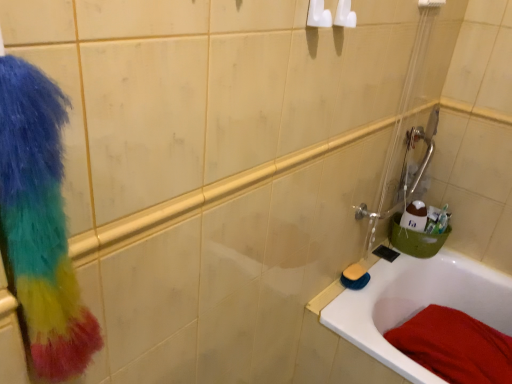
What do you see at coordinates (417, 304) in the screenshot?
I see `white glossy bathtub at lower right` at bounding box center [417, 304].

What do you see at coordinates (40, 222) in the screenshot? I see `multicolored fluffy scrub at left` at bounding box center [40, 222].

Describe the element at coordinates (355, 277) in the screenshot. Image resolution: width=512 pixels, height=384 pixels. I see `yellow sponge at lower right` at that location.

Image resolution: width=512 pixels, height=384 pixels. What do you see at coordinates (354, 272) in the screenshot?
I see `yellow sponge at lower right` at bounding box center [354, 272].

Describe the element at coordinates (455, 346) in the screenshot. I see `red cotton towel at lower right` at that location.

Where is `white glossy bathtub at lower right`? This screenshot has width=512, height=384. white glossy bathtub at lower right is located at coordinates (417, 304).

What's the angular difference between multicolored fluffy scrub at left and yellow sponge at lower right's facing directions?

The facing directions of multicolored fluffy scrub at left and yellow sponge at lower right are 0.659 degrees apart.

Is multicolored fluffy scrub at left completely or partially outside of yellow sponge at lower right?

Absolutely, multicolored fluffy scrub at left is external to yellow sponge at lower right.

From a real-world perspective, between multicolored fluffy scrub at left and yellow sponge at lower right, who is vertically lower?

yellow sponge at lower right, from a real-world perspective.

Considering the points (52, 365) and (361, 271), which point is in front, point (52, 365) or point (361, 271)?

Positioned in front is point (52, 365).

Does green plastic bucket at right have a greater height compared to white glossy bathtub at lower right?

No, green plastic bucket at right is not taller than white glossy bathtub at lower right.

Where is `bathtub lying in front of the green plastic bucket at right`? Image resolution: width=512 pixels, height=384 pixels. bathtub lying in front of the green plastic bucket at right is located at coordinates (417, 304).

From a real-world perspective, relative to white glossy bathtub at lower right, is green plastic bucket at right vertically above or below?

From a real-world perspective, green plastic bucket at right is physically above white glossy bathtub at lower right.

From the picture: Which of these two, white glossy bathtub at lower right or green plastic bucket at right, is wider?

Wider between the two is white glossy bathtub at lower right.

From the image's perspective, who appears lower, white glossy bathtub at lower right or green plastic bucket at right?

white glossy bathtub at lower right appears lower in the image.

Who is taller, white glossy bathtub at lower right or green plastic bucket at right?

Standing taller between the two is white glossy bathtub at lower right.

Is white glossy bathtub at lower right bigger than green plastic bucket at right?

Yes.

From the image's perspective, which one is positioned higher, green plastic bucket at right or yellow sponge at lower right?

green plastic bucket at right.

How much distance is there between green plastic bucket at right and yellow sponge at lower right?

green plastic bucket at right is 10.70 inches away from yellow sponge at lower right.

Which object is further away from the camera taking this photo, green plastic bucket at right or yellow sponge at lower right?

Positioned behind is green plastic bucket at right.

Measure the distance between white glossy bathtub at lower right and red cotton towel at lower right.

white glossy bathtub at lower right is 6.11 inches away from red cotton towel at lower right.

Identify the location of bath towel behind the white glossy bathtub at lower right. (455, 346).

Who is more distant, white glossy bathtub at lower right or red cotton towel at lower right?

Positioned behind is red cotton towel at lower right.

Is white glossy bathtub at lower right in contact with red cotton towel at lower right?

white glossy bathtub at lower right and red cotton towel at lower right are clearly separated.

Locate an element on the screen. scrub above the red cotton towel at lower right (from a real-world perspective) is located at coordinates (40, 222).

Considering the relative positions of red cotton towel at lower right and multicolored fluffy scrub at left in the image provided, is red cotton towel at lower right to the left or to the right of multicolored fluffy scrub at left?

From the image, it's evident that red cotton towel at lower right is to the right of multicolored fluffy scrub at left.

Is red cotton towel at lower right taller than multicolored fluffy scrub at left?

Incorrect, the height of red cotton towel at lower right is not larger of that of multicolored fluffy scrub at left.

In terms of height, does yellow sponge at lower right look taller or shorter compared to white glossy bathtub at lower right?

In the image, yellow sponge at lower right appears to be shorter than white glossy bathtub at lower right.

Based on the photo, from a real-world perspective, who is located higher, yellow sponge at lower right or white glossy bathtub at lower right?

In real-world perspective, yellow sponge at lower right is above.

Looking at this image, is yellow sponge at lower right positioned beyond the bounds of white glossy bathtub at lower right?

→ No, yellow sponge at lower right is inside or overlapping with white glossy bathtub at lower right.

You are a GUI agent. You are given a task and a screenshot of the screen. Output one action in this format:
    pyautogui.click(x=<x>, y=<y>)
    Task: Click on the scrub in front of the yellow sponge at lower right
    
    Given the screenshot: What is the action you would take?
    pyautogui.click(x=40, y=222)

Find the location of a particular element. This screenshot has width=512, height=384. bathtub below the green plastic bucket at right (from a real-world perspective) is located at coordinates (417, 304).

From the image, which object appears to be farther from yellow sponge at lower right, white glossy bathtub at lower right or red cotton towel at lower right?

red cotton towel at lower right is positioned further to the anchor yellow sponge at lower right.

Which object lies further to the anchor point yellow sponge at lower right, yellow sponge at lower right or green plastic bucket at right?

green plastic bucket at right is positioned further to the anchor yellow sponge at lower right.

When comparing their distances from green plastic bucket at right, does white glossy bathtub at lower right or yellow sponge at lower right seem further?

yellow sponge at lower right is positioned further to the anchor green plastic bucket at right.

Looking at the image, which one is located further to white glossy bathtub at lower right, multicolored fluffy scrub at left or red cotton towel at lower right?

Among the two, multicolored fluffy scrub at left is located further to white glossy bathtub at lower right.

When comparing their distances from green plastic bucket at right, does multicolored fluffy scrub at left or yellow sponge at lower right seem closer?

yellow sponge at lower right is closer to green plastic bucket at right.

Looking at the image, which one is located closer to multicolored fluffy scrub at left, red cotton towel at lower right or white glossy bathtub at lower right?

Based on the image, white glossy bathtub at lower right appears to be nearer to multicolored fluffy scrub at left.

When comparing their distances from white glossy bathtub at lower right, does yellow sponge at lower right or yellow sponge at lower right seem further?

yellow sponge at lower right.

Which object lies nearer to the anchor point red cotton towel at lower right, white glossy bathtub at lower right or green plastic bucket at right?

Among the two, white glossy bathtub at lower right is located nearer to red cotton towel at lower right.

Find the location of `soap located between multicolored fluffy scrub at left and green plastic bucket at right in the depth direction`. soap located between multicolored fluffy scrub at left and green plastic bucket at right in the depth direction is located at coordinates (354, 272).

Locate an element on the screen. bath towel between white glossy bathtub at lower right and green plastic bucket at right from front to back is located at coordinates (455, 346).

You are a GUI agent. You are given a task and a screenshot of the screen. Output one action in this format:
    pyautogui.click(x=<x>, y=<y>)
    Task: Click on the brush located between multicolored fluffy scrub at left and yellow sponge at lower right in the depth direction
    This screenshot has height=384, width=512.
    Given the screenshot: What is the action you would take?
    pyautogui.click(x=355, y=277)

You are a GUI agent. You are given a task and a screenshot of the screen. Output one action in this format:
    pyautogui.click(x=<x>, y=<y>)
    Task: Click on the bath towel between multicolored fluffy scrub at left and green plastic bucket at right from front to back
    
    Given the screenshot: What is the action you would take?
    pyautogui.click(x=455, y=346)